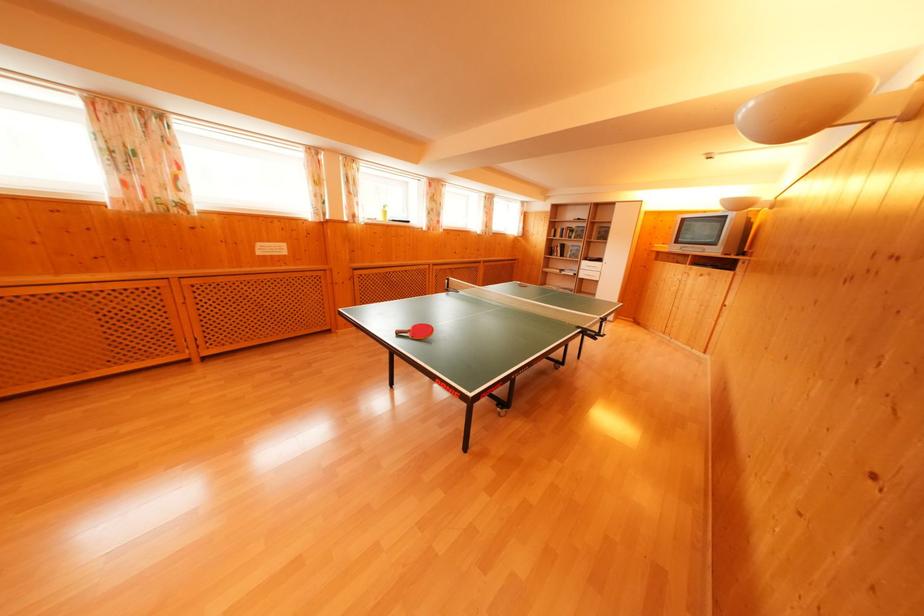
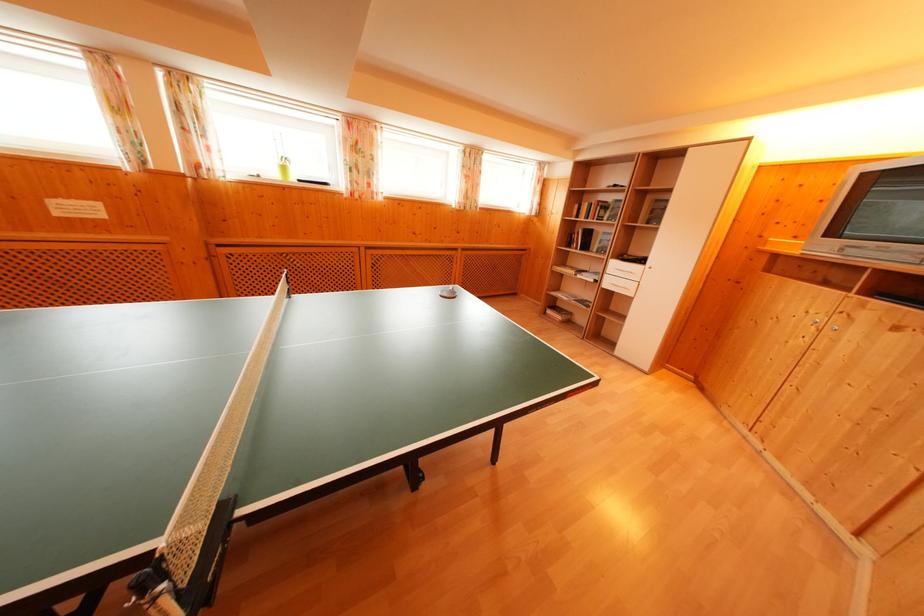
The point at (390, 217) is marked in the first image. Where is the corresponding point in the second image?

(288, 174)